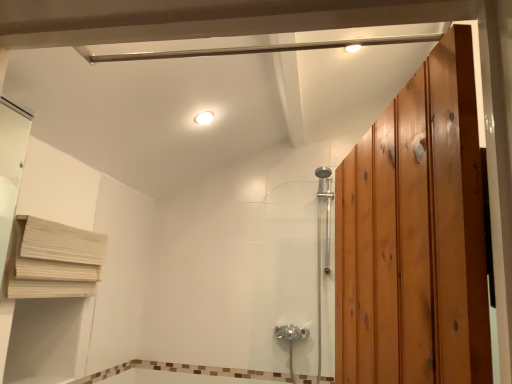
Question: Looking at their shapes, would you say chrome metallic shower door at center is wider or thinner than wooden at left?

Choices:
 (A) wide
 (B) thin

Answer: (A)

Question: Is chrome metallic shower door at center bigger or smaller than wooden at left?

Choices:
 (A) big
 (B) small

Answer: (A)

Question: Which object is positioned farthest from the white glossy light fixture at upper center?

Choices:
 (A) wooden at left
 (B) chrome metallic shower door at center
 (C) brown mosaic tile at lower center

Answer: (C)

Question: Which of these objects is positioned closest to the brown mosaic tile at lower center?

Choices:
 (A) white glossy light fixture at upper center
 (B) wooden at left
 (C) chrome metallic shower door at center

Answer: (C)